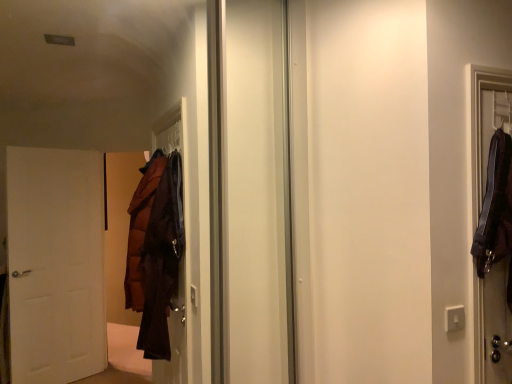
Question: Should I look upward or downward to see white plastic electric outlet at lower right?

Choices:
 (A) up
 (B) down

Answer: (B)